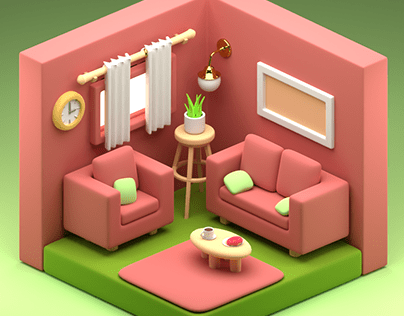
What are the coordinates of `curtains` in the screenshot? It's located at tap(118, 99), tap(162, 85).